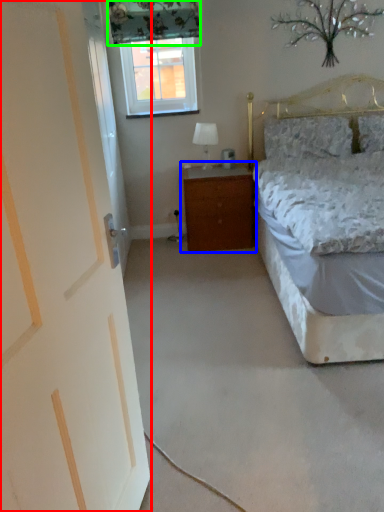
Question: Considering the real-world distances, which object is closest to door (highlighted by a red box)? nightstand (highlighted by a blue box) or curtain (highlighted by a green box).

Choices:
 (A) nightstand
 (B) curtain

Answer: (A)